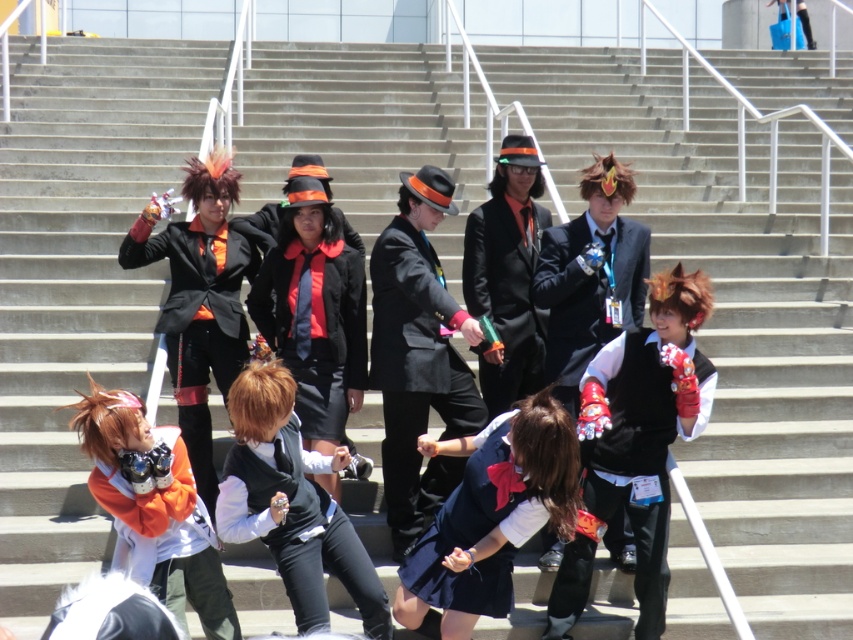
You are a photographer setting up for a group photo. You notice a white matte vest at center and a black matte suit at center. Which of these two items has a wider width according to their positions?

The white matte vest at center has a wider width than the black matte suit at center.

You are standing on the stairs in the image and want to move towards the point that is closer to you. Which point should you walk towards, point (525, 486) or point (254, 259)?

You should walk towards point (525, 486) because it is closer to the viewer than point (254, 259).

In the scene shown: You are a photographer trying to capture a group photo of the cosplayers on the stairs. You notice the matte blue skirt at center and the matte black vest at center. To ensure both items are clearly visible in the photo, which one should you focus on first, considering their sizes?

The matte blue skirt at center might be wider than the matte black vest at center, so focusing on the matte blue skirt at center first would ensure it is clearly visible due to its potentially larger size.